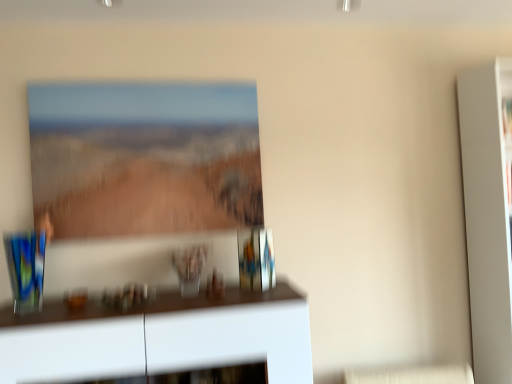
Find the location of a particular element. Image resolution: width=512 pixels, height=384 pixels. free space above matte glass picture frame at upper center (from a real-world perspective) is located at coordinates (144, 78).